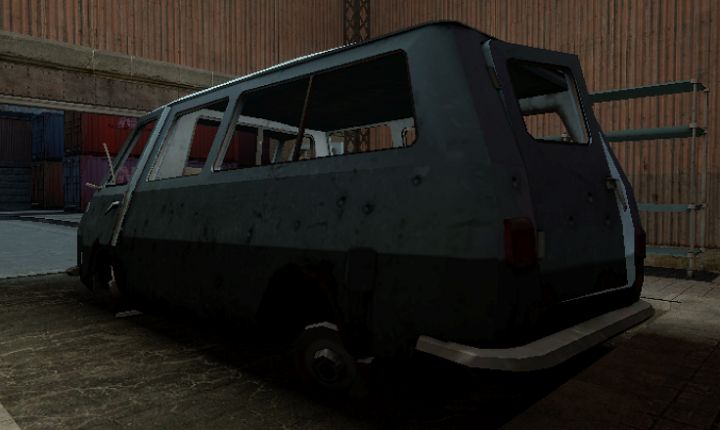
The width and height of the screenshot is (720, 430). Find the location of `floor`. floor is located at coordinates (78, 365).